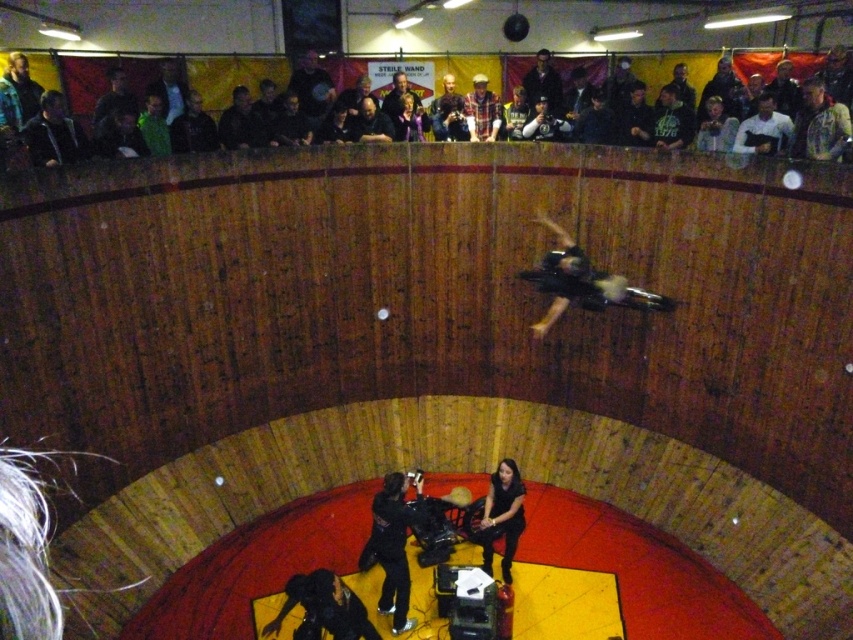
You are a photographer at the circus performance. You need to take a photo of the dark green jersey at upper center. The arena has a circular wooden stage with a red floor. Where should you position yourself to ensure the point at coordinates point (671, 120) is centered in your shot?

The point (671, 120) is on the dark green jersey at upper center, so you should position yourself directly opposite the upper center area of the arena to center the point in your shot.

You are a stagehand in the circus arena. You need to move a 12 inch long ladder from the dark blue jacket at upper center to the dark gray hoodie at upper left. Is there enough space for the ladder to fit between them without bending it?

The distance between the dark blue jacket at upper center and dark gray hoodie at upper left is 13.95 inches, which is longer than the 12 inch ladder. Therefore, the ladder can fit straight between them without bending.

You are a stagehand in the circus arena. You need to place a new prop that must be exactly 0.5 units away from the black matte skateboard at center along the x and y axes. Where should you place it?

The black matte skateboard at center is located at coordinates [581,282]. To place the new prop exactly 0.5 units away along both the x and y axes, you would position it at either [852,602] or 0.442 plus or minus 0.5 in both directions. However, since coordinates typically range from 0 to 1, the valid position within the arena would be at [852,602] or 0.442 minus 0.5 in either axis. But since coordinates can not exceed 1, the valid position would be at [852,602] or 0.442 minus 0.5 in either axis